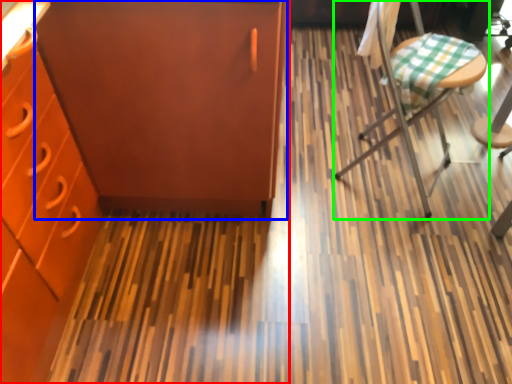
Question: Which object is positioned farthest from cabinetry (highlighted by a red box)? Select from file cabinet (highlighted by a blue box) and chair (highlighted by a green box).

Choices:
 (A) file cabinet
 (B) chair

Answer: (B)